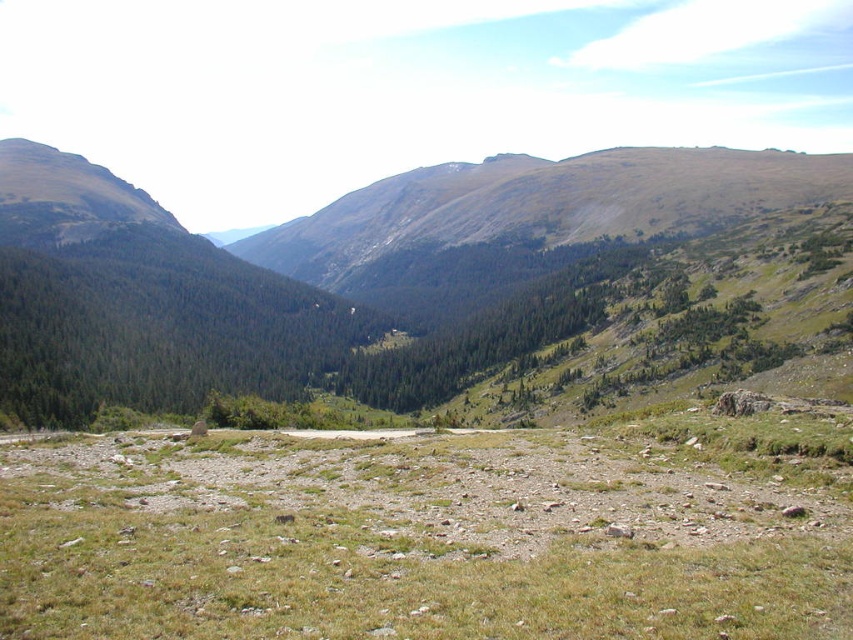
Is green grassy terrain at center wider than green grassy mountain at left?

No.

Can you confirm if green grassy terrain at center is bigger than green grassy mountain at left?

No.

Find the location of a particular element. green grassy terrain at center is located at coordinates (407, 541).